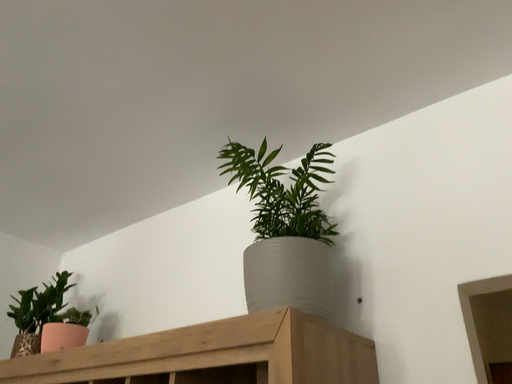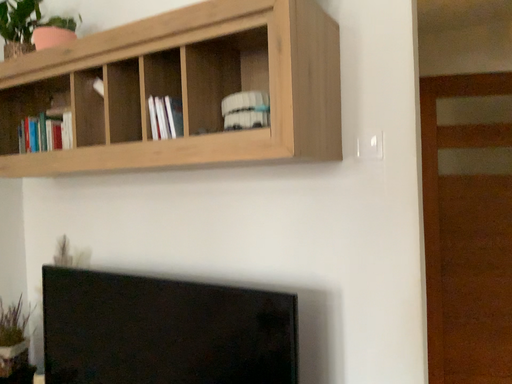
Question: How did the camera likely rotate when shooting the video?

Choices:
 (A) rotated upward
 (B) rotated downward

Answer: (B)